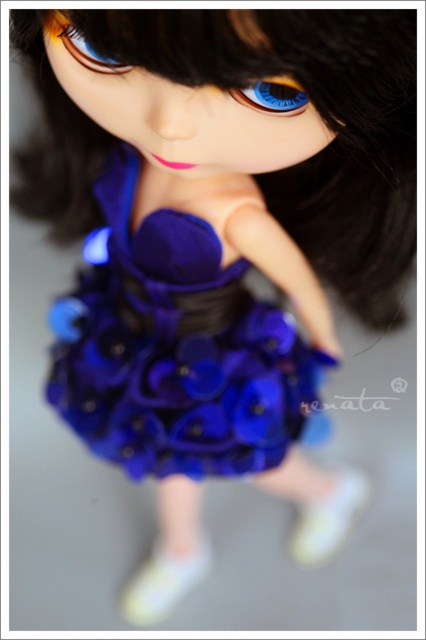
Question: In this image, where is white fabric shoe at lower right located relative to blue glossy eye at upper center?

Choices:
 (A) left
 (B) right

Answer: (B)

Question: Is satin royal blue dress at center positioned at the back of blue glossy eye at upper center?

Choices:
 (A) no
 (B) yes

Answer: (B)

Question: Which point is closer to the camera taking this photo?

Choices:
 (A) (126, 397)
 (B) (275, 104)

Answer: (B)

Question: Which of these objects is positioned farthest from the blue glossy eye at center?

Choices:
 (A) white fabric shoe at lower right
 (B) satin royal blue dress at center
 (C) white matte socks at lower center
 (D) blue glossy eye at upper center

Answer: (C)

Question: Which of the following is the closest to the observer?

Choices:
 (A) (89, 417)
 (B) (336, 538)

Answer: (A)

Question: Is white fabric shoe at lower right thinner than blue glossy eye at center?

Choices:
 (A) no
 (B) yes

Answer: (A)